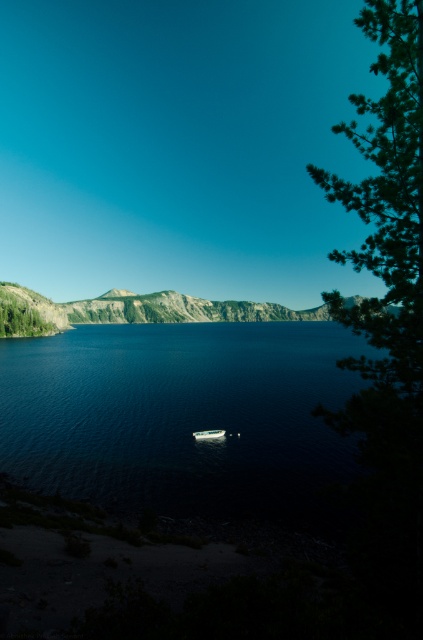
Measure the distance between green leafy tree at right and camera.

The distance of green leafy tree at right from camera is 47.59 feet.

Which is in front, point (422, 218) or point (216, 433)?

Point (422, 218) is in front.

Identify the location of green leafy tree at right. The image size is (423, 640). (387, 202).

Where is `green leafy tree at right`? green leafy tree at right is located at coordinates (387, 202).

Does point (395, 232) come behind point (43, 317)?

No, it is in front of (43, 317).

Between green leafy tree at right and green matte tree at left, which one has more height?

With more height is green leafy tree at right.

Is point (406, 33) farther from viewer compared to point (11, 323)?

That is False.

The image size is (423, 640). I want to click on green leafy tree at right, so click(x=387, y=202).

Is deep blue water at center wider than white plastic boat at center?

Indeed, deep blue water at center has a greater width compared to white plastic boat at center.

The width and height of the screenshot is (423, 640). What do you see at coordinates (184, 419) in the screenshot?
I see `deep blue water at center` at bounding box center [184, 419].

Is point (90, 496) less distant than point (200, 432)?

That is True.

This screenshot has width=423, height=640. What are the coordinates of `deep blue water at center` in the screenshot? It's located at pyautogui.click(x=184, y=419).